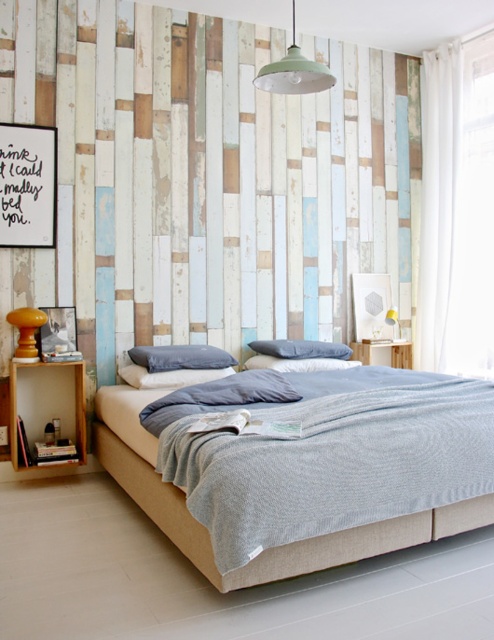
Is dark gray fabric pillow at center thinner than blue cotton pillow at center?

Correct, dark gray fabric pillow at center's width is less than blue cotton pillow at center's.

Is dark gray fabric pillow at center behind blue cotton pillow at center?

No, it is in front of blue cotton pillow at center.

Who is more forward, (155, 371) or (273, 358)?

Positioned in front is point (155, 371).

What are the coordinates of `dark gray fabric pillow at center` in the screenshot? It's located at (179, 356).

Who is more distant from viewer, (166, 371) or (251, 348)?

Point (251, 348)

Who is shorter, light blue fabric pillow at center or blue soft pillow at center?

Standing shorter between the two is light blue fabric pillow at center.

Find the location of a particular element. Image resolution: width=494 pixels, height=640 pixels. light blue fabric pillow at center is located at coordinates click(169, 376).

Image resolution: width=494 pixels, height=640 pixels. I want to click on light blue fabric pillow at center, so click(x=169, y=376).

Does light beige fabric bed at center appear on the right side of light blue fabric pillow at center?

Correct, you'll find light beige fabric bed at center to the right of light blue fabric pillow at center.

Is point (208, 541) behind point (164, 387)?

No, (208, 541) is closer to viewer.

Where is `light beige fabric bed at center`? This screenshot has width=494, height=640. light beige fabric bed at center is located at coordinates (310, 472).